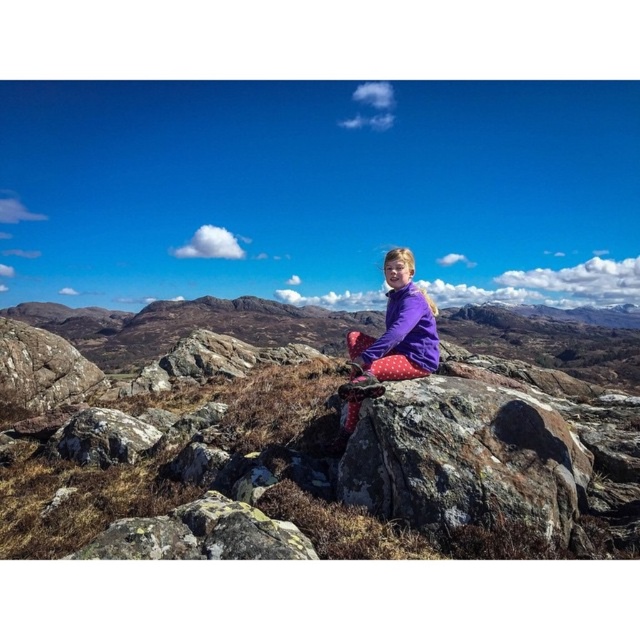
Looking at this image, you are a hiker who needs to set up a campsite between the rugged stone mountain at center and the rough textured rock at center. Considering the distance between them, can you estimate if a standard tent that requires a 10 meter space would fit comfortably between them?

The distance between the rugged stone mountain at center and the rough textured rock at center is 12.92 meters. Since a standard tent requires 10 meters of space, there is enough room to comfortably set up the tent between them with 2.92 meters of extra space remaining.